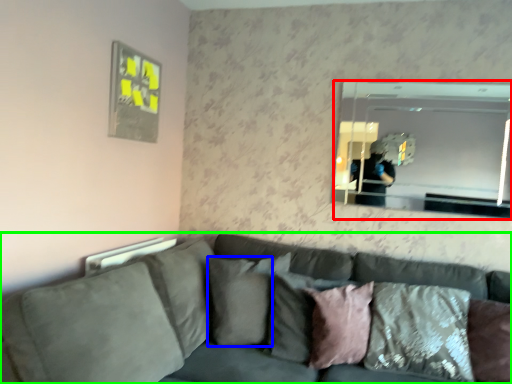
Question: Which is farther away from mirror (highlighted by a red box)? pillow (highlighted by a blue box) or studio couch (highlighted by a green box)?

Choices:
 (A) pillow
 (B) studio couch

Answer: (A)